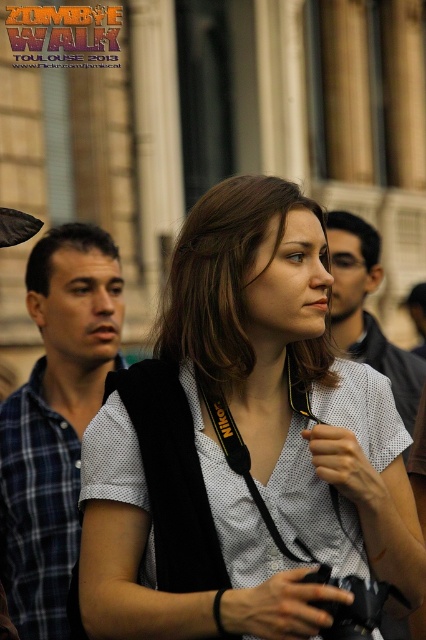
You are a photographer at the Zombie Walk event in Toulouse. You notice a participant wearing a blue plaid shirt at left and another wearing a matte white shirt at center. Which participant is closer to the camera?

The blue plaid shirt at left is closer to the camera because the matte white shirt at center is behind it.

In the scene shown: In the image of the 2013 Zombie Walk in Toulouse, there are two participants wearing a white mesh shirt at center and a matte white shirt at center. Which one is positioned to the left?

The white mesh shirt at center is positioned to the left of the matte white shirt at center.

You are a photographer at the Zombie Walk event in Toulouse. You need to capture a photo of the two participants wearing the blue plaid shirt at left and the matte white shirt at center. Considering their positions, which participant is standing closer to the left side of the frame?

The blue plaid shirt at left is positioned to the left of the matte white shirt at center, so the participant wearing the blue plaid shirt at left is closer to the left side of the frame.